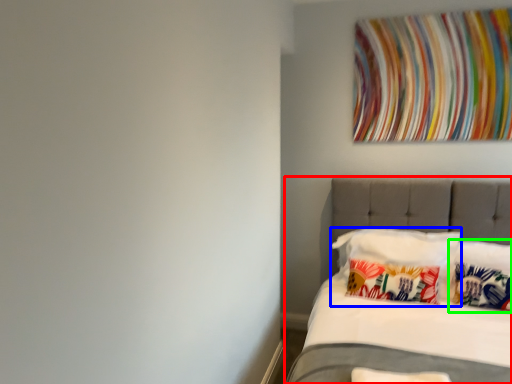
Question: Estimate the real-world distances between objects in this image. Which object is farther from bed (highlighted by a red box), pillow (highlighted by a blue box) or pillow (highlighted by a green box)?

Choices:
 (A) pillow
 (B) pillow

Answer: (B)